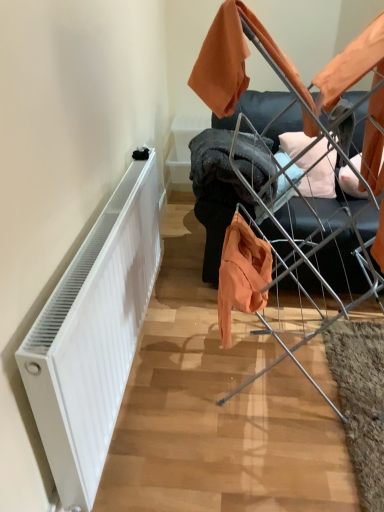
Question: Considering the positions of white matte radiator at left and metallic silver baby carriage at center in the image, is white matte radiator at left wider or thinner than metallic silver baby carriage at center?

Choices:
 (A) wide
 (B) thin

Answer: (B)

Question: In the image, is white matte radiator at left positioned in front of or behind metallic silver baby carriage at center?

Choices:
 (A) front
 (B) behind

Answer: (A)

Question: Estimate the real-world distances between objects in this image. Which object is closer to the white matte radiator at left?

Choices:
 (A) metal wire drying rack at upper right
 (B) metallic silver baby carriage at center

Answer: (B)

Question: Estimate the real-world distances between objects in this image. Which object is farther from the metal wire drying rack at upper right?

Choices:
 (A) metallic silver baby carriage at center
 (B) white matte radiator at left

Answer: (B)